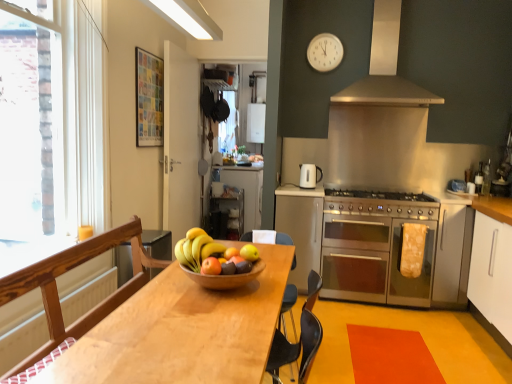
Question: From a real-world perspective, is stainless steel oven at center right located beneath metallic silver microwave at center, positioned as the second appliance in right-to-left order?

Choices:
 (A) no
 (B) yes

Answer: (B)

Question: Is stainless steel oven at center right shorter than metallic silver microwave at center, which is the first appliance in bottom-to-top order?

Choices:
 (A) no
 (B) yes

Answer: (A)

Question: Can you confirm if stainless steel oven at center right is thinner than metallic silver microwave at center, the second appliance positioned from the front?

Choices:
 (A) yes
 (B) no

Answer: (B)

Question: Is stainless steel oven at center right completely or partially outside of metallic silver microwave at center, positioned as the second appliance in right-to-left order?

Choices:
 (A) yes
 (B) no

Answer: (A)

Question: Is stainless steel oven at center right further to camera compared to metallic silver microwave at center, the 1th appliance when ordered from left to right?

Choices:
 (A) no
 (B) yes

Answer: (A)

Question: Is orange matte at center situated inside matte yellow apple at center, the second apple positioned from the front, or outside?

Choices:
 (A) inside
 (B) outside

Answer: (B)

Question: Considering the positions of orange matte at center and matte yellow apple at center, the second apple when ordered from left to right, in the image, is orange matte at center bigger or smaller than matte yellow apple at center, the second apple when ordered from left to right,?

Choices:
 (A) big
 (B) small

Answer: (A)

Question: From the image's perspective, is orange matte at center above or below matte yellow apple at center, which appears as the first apple when viewed from the right?

Choices:
 (A) above
 (B) below

Answer: (A)

Question: Considering the positions of point (232, 256) and point (245, 253), is point (232, 256) closer or farther from the camera than point (245, 253)?

Choices:
 (A) farther
 (B) closer

Answer: (B)

Question: In the image, is white glossy cabinet at center, arranged as the second cabinetry when viewed from the front, on the left side or the right side of light brown wooden table at center?

Choices:
 (A) left
 (B) right

Answer: (B)

Question: Is point 313,228 closer or farther from the camera than point 82,360?

Choices:
 (A) closer
 (B) farther

Answer: (B)

Question: Is white glossy cabinet at center, positioned as the 2th cabinetry in left-to-right order, taller or shorter than light brown wooden table at center?

Choices:
 (A) tall
 (B) short

Answer: (A)

Question: In the image, is white glossy cabinet at center, the second cabinetry viewed from the right, positioned in front of or behind light brown wooden table at center?

Choices:
 (A) front
 (B) behind

Answer: (B)

Question: Is matte orange apple at center, the 1th apple in the left-to-right sequence, bigger or smaller than white glossy electric kettle at upper center?

Choices:
 (A) big
 (B) small

Answer: (B)

Question: In terms of height, does matte orange apple at center, the 1th apple in the left-to-right sequence, look taller or shorter compared to white glossy electric kettle at upper center?

Choices:
 (A) short
 (B) tall

Answer: (A)